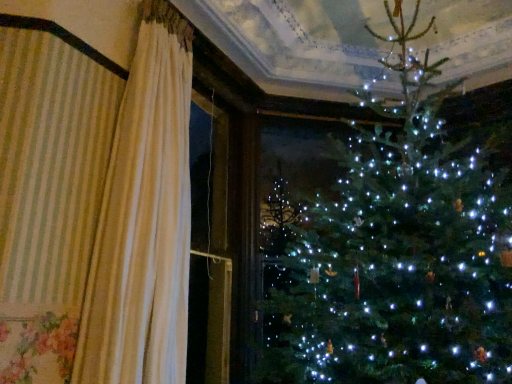
The width and height of the screenshot is (512, 384). What are the coordinates of `white silk curtain at left` in the screenshot? It's located at [x=96, y=201].

The height and width of the screenshot is (384, 512). Describe the element at coordinates (96, 201) in the screenshot. I see `white silk curtain at left` at that location.

You are a GUI agent. You are given a task and a screenshot of the screen. Output one action in this format:
    pyautogui.click(x=<x>, y=<y>)
    Task: Click on the white silk curtain at left
    The width and height of the screenshot is (512, 384).
    Given the screenshot: What is the action you would take?
    pyautogui.click(x=96, y=201)